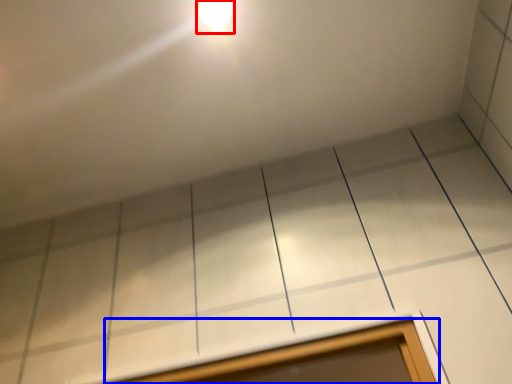
Question: Which of the following is the closest to the observer, light fixture (highlighted by a red box) or window (highlighted by a blue box)?

Choices:
 (A) light fixture
 (B) window

Answer: (B)